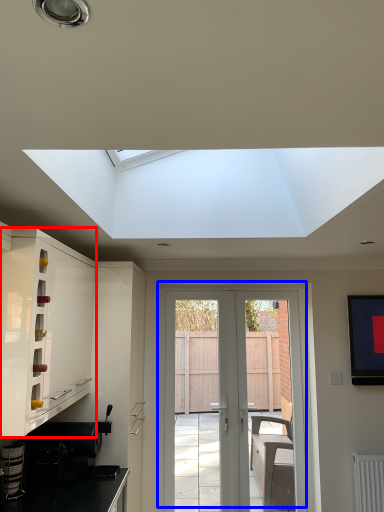
Question: Among these objects, which one is farthest to the camera, cabinetry (highlighted by a red box) or door (highlighted by a blue box)?

Choices:
 (A) cabinetry
 (B) door

Answer: (B)